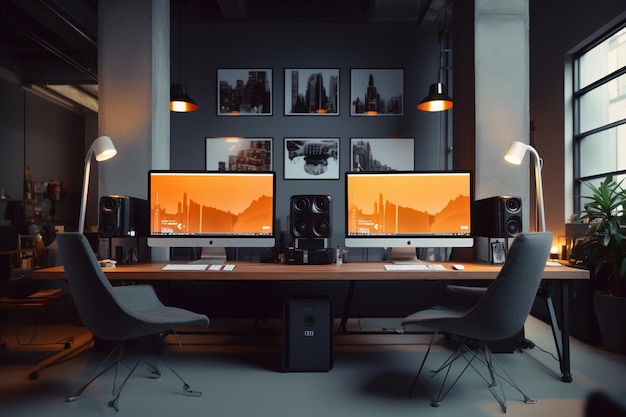
Locate an element on the screen. desk is located at coordinates (310, 274).